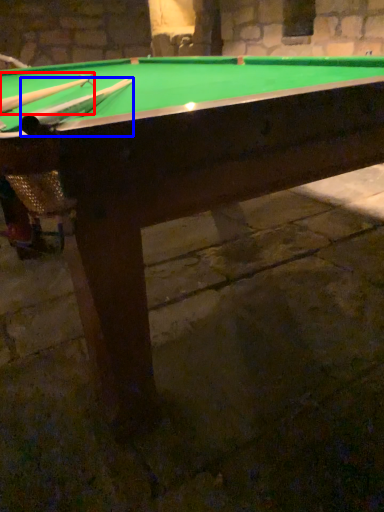
Question: Which object appears closest to the camera in this image, cue (highlighted by a red box) or cue (highlighted by a blue box)?

Choices:
 (A) cue
 (B) cue

Answer: (B)